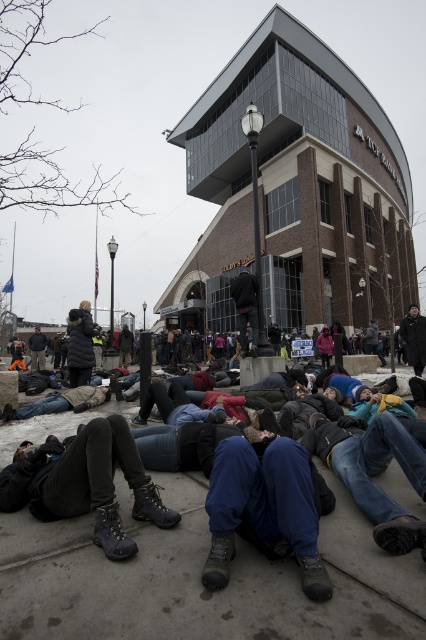
Image resolution: width=426 pixels, height=640 pixels. I want to click on blue jeans at lower center, so click(374, 474).

Is blue jeans at lower center further to the viewer compared to black puffy coat at center?

No, it is not.

Find the location of a particular element. Image resolution: width=426 pixels, height=640 pixels. blue jeans at lower center is located at coordinates tap(374, 474).

Identify the location of blue jeans at lower center. This screenshot has height=640, width=426. (374, 474).

Based on the photo, is blue suede boots at center taller than black puffy coat at center?

Incorrect, blue suede boots at center's height is not larger of black puffy coat at center's.

Who is lower down, blue suede boots at center or black puffy coat at center?

blue suede boots at center

Where is `blue suede boots at center`? Image resolution: width=426 pixels, height=640 pixels. blue suede boots at center is located at coordinates (264, 508).

Which is above, dark gray leather boots at lower left or black puffy coat at center?

black puffy coat at center is higher up.

Is point (65, 452) farther from camera compared to point (86, 305)?

No, it is in front of (86, 305).

Where is `dark gray leather boots at lower left`? This screenshot has width=426, height=640. dark gray leather boots at lower left is located at coordinates (86, 483).